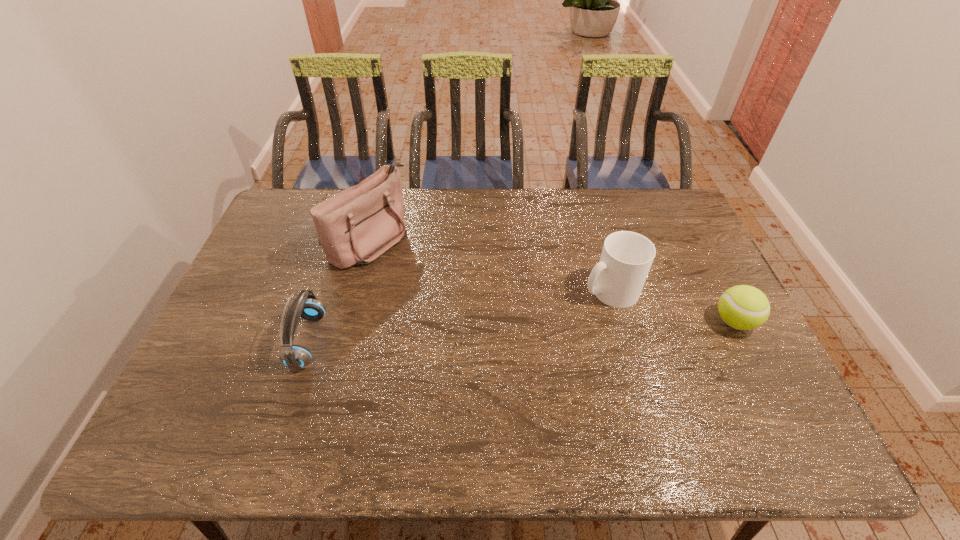
Find the location of a particular element. The width and height of the screenshot is (960, 540). empty space between the shoulder bag and the shortest object is located at coordinates (552, 281).

In order to click on object that is the closest to the rightmost object in this screenshot , I will do `click(617, 280)`.

Identify which object is the closest to the farthest object. Please provide its 2D coordinates. Your answer should be formatted as a tuple, i.e. [(x, y)], where the tuple contains the x and y coordinates of a point satisfying the conditions above.

[(296, 357)]

At what (x,y) coordinates should I click in order to perform the action: click on vacant space that satisfies the following two spatial constraints: 1. on the front side of the shoulder bag; 2. on the left side of the shortest object. Please return your answer as a coordinate pair (x, y). Looking at the image, I should click on (348, 322).